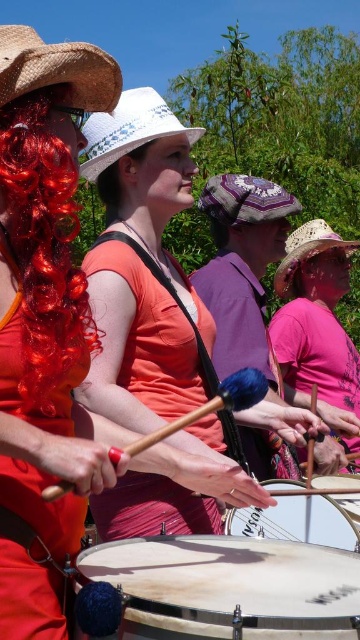
Question: Is patterned fabric cowboy hat at center to the left of smooth white drum at center from the viewer's perspective?

Choices:
 (A) no
 (B) yes

Answer: (B)

Question: Can you confirm if smooth wooden drum at center is smaller than rustic straw cowboy hat at center?

Choices:
 (A) no
 (B) yes

Answer: (B)

Question: Is matte orange shirt at center bigger than white woven hat at center?

Choices:
 (A) no
 (B) yes

Answer: (B)

Question: Which of the following is the farthest from the observer?

Choices:
 (A) patterned fabric cowboy hat at center
 (B) straw textured cowboy hat at upper left
 (C) smooth white drum at center
 (D) rustic straw cowboy hat at center

Answer: (D)

Question: Among these points, which one is farthest from the camera?

Choices:
 (A) (x=34, y=605)
 (B) (x=351, y=499)
 (C) (x=330, y=525)
 (D) (x=275, y=280)

Answer: (D)

Question: Estimate the real-world distances between objects in this image. Which object is farther from the white drum at center?

Choices:
 (A) smooth white drum at center
 (B) blonde hair at center

Answer: (B)